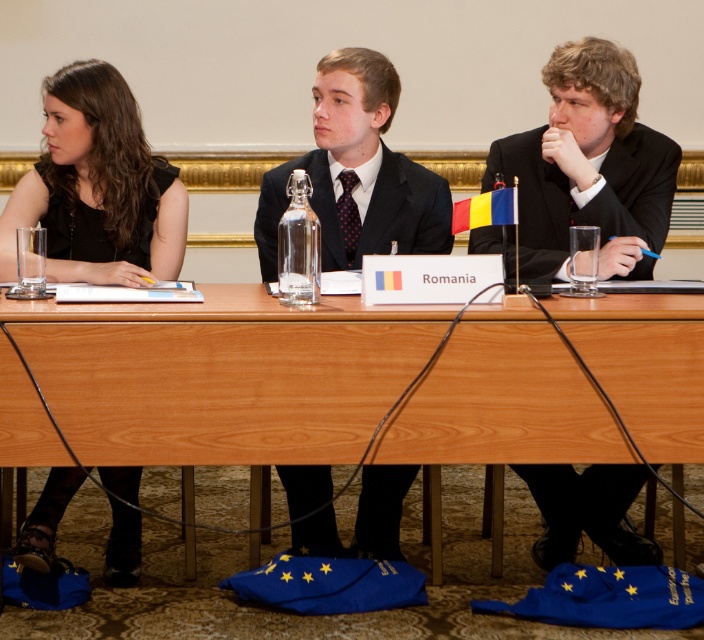
Can you confirm if black suit at center is positioned to the right of black matte dress at left?

Yes, black suit at center is to the right of black matte dress at left.

Between point (591, 474) and point (61, 204), which one is positioned behind?

The point (591, 474) is more distant.

Find the location of a particular element. The image size is (704, 640). black suit at center is located at coordinates (589, 168).

Locate an element on the screen. Image resolution: width=704 pixels, height=640 pixels. black suit at center is located at coordinates (589, 168).

Can you confirm if black matte dress at left is smaller than matte black suit at center?

No, black matte dress at left is not smaller than matte black suit at center.

How much distance is there between black matte dress at left and matte black suit at center?

black matte dress at left is 22.45 inches from matte black suit at center.

Which is behind, point (177, 225) or point (337, 113)?

The point (177, 225) is behind.

The width and height of the screenshot is (704, 640). I want to click on black matte dress at left, so click(x=96, y=188).

Between wooden table at center and black matte dress at left, which one has less height?

wooden table at center is shorter.

Which is more to the right, wooden table at center or black matte dress at left?

Positioned to the right is wooden table at center.

Between point (577, 401) and point (80, 144), which one is positioned behind?

Positioned behind is point (80, 144).

Locate an element on the screen. The image size is (704, 640). wooden table at center is located at coordinates (222, 378).